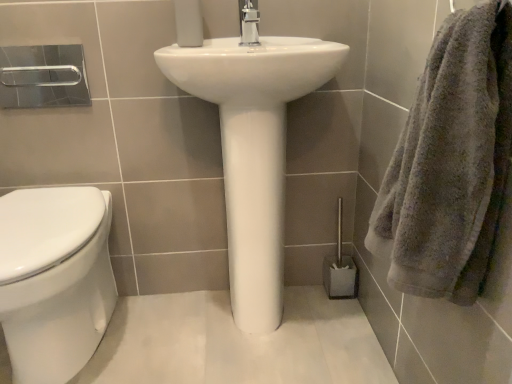
You are a GUI agent. You are given a task and a screenshot of the screen. Output one action in this format:
    pyautogui.click(x=<x>, y=<y>)
    Task: Click on the vacant space that is in between white glossy toilet at left and white glossy sink at center
    The image size is (512, 384).
    Given the screenshot: What is the action you would take?
    pyautogui.click(x=181, y=345)